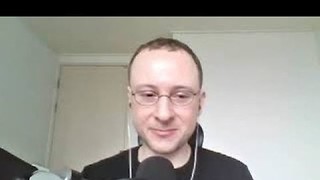
Locate an element on the screen. This screenshot has height=180, width=320. headrest is located at coordinates (201, 135).